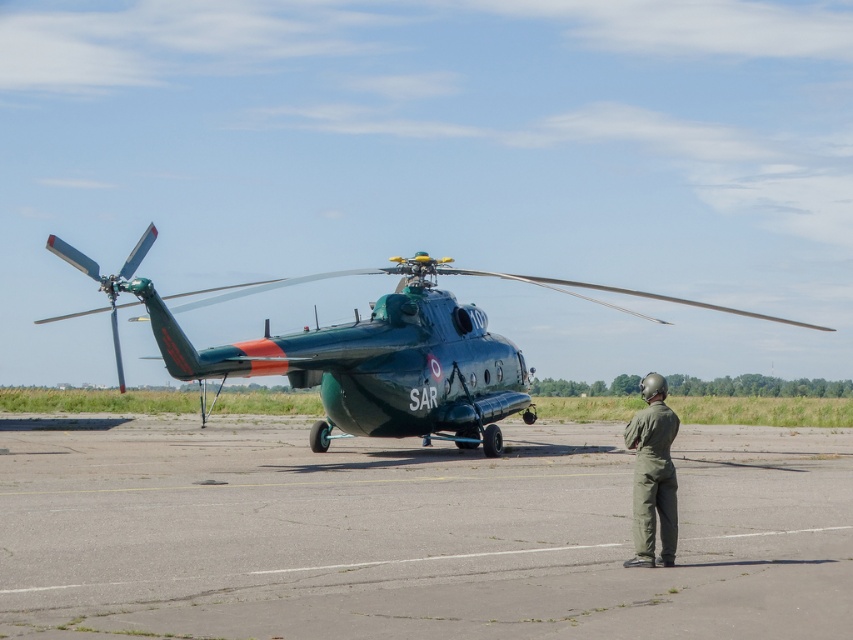
Question: Which point is closer to the camera taking this photo?

Choices:
 (A) (670, 593)
 (B) (463, 336)
 (C) (660, 506)

Answer: (A)

Question: Estimate the real-world distances between objects in this image. Which object is closer to the green fabric jumpsuit at lower right?

Choices:
 (A) gray asphalt tarmac at center
 (B) green metallic helicopter at center

Answer: (A)

Question: Which point is closer to the camera?

Choices:
 (A) (397, 568)
 (B) (556, 285)

Answer: (A)

Question: Does gray asphalt tarmac at center appear on the left side of green fabric jumpsuit at lower right?

Choices:
 (A) no
 (B) yes

Answer: (B)

Question: Is green metallic helicopter at center smaller than green fabric jumpsuit at lower right?

Choices:
 (A) no
 (B) yes

Answer: (A)

Question: From the image, what is the correct spatial relationship of green metallic helicopter at center in relation to green fabric jumpsuit at lower right?

Choices:
 (A) left
 (B) right

Answer: (A)